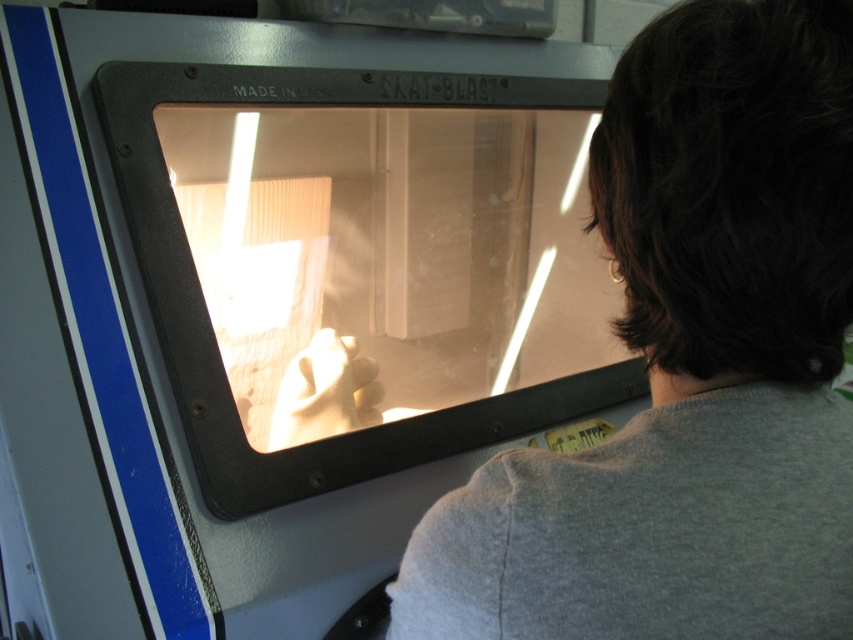
How distant is gray cotton shirt at center from transparent glass screen at center?

They are 21.40 inches apart.

What are the coordinates of `gray cotton shirt at center` in the screenshot? It's located at (689, 364).